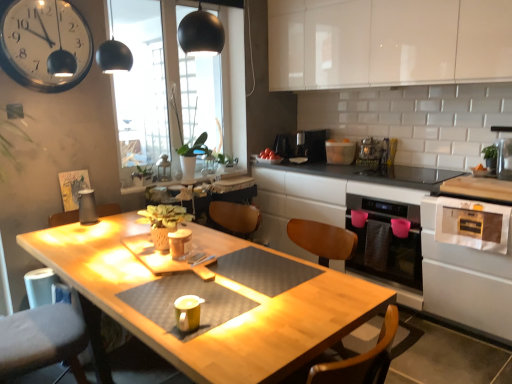
Question: Is white glossy clock at upper left shorter than white glossy toaster at upper center, the sixth appliance viewed from the left?

Choices:
 (A) no
 (B) yes

Answer: (A)

Question: Is white glossy toaster at upper center, positioned as the 3th appliance in right-to-left order, located within white glossy clock at upper left?

Choices:
 (A) no
 (B) yes

Answer: (A)

Question: Is white glossy clock at upper left next to white glossy toaster at upper center, marked as the 3th appliance in a back-to-front arrangement, and touching it?

Choices:
 (A) yes
 (B) no

Answer: (B)

Question: Is white glossy clock at upper left positioned beyond the bounds of white glossy toaster at upper center, the sixth appliance viewed from the left?

Choices:
 (A) no
 (B) yes

Answer: (B)

Question: Could you tell me if white glossy clock at upper left is turned towards white glossy toaster at upper center, the sixth appliance viewed from the left?

Choices:
 (A) yes
 (B) no

Answer: (B)

Question: From a real-world perspective, does white glossy clock at upper left stand above white glossy toaster at upper center, marked as the 3th appliance in a back-to-front arrangement?

Choices:
 (A) no
 (B) yes

Answer: (B)

Question: Is white glossy oven at lower right, placed as the 2th oven when sorted from back to front, outside of matte yellow cup at center, placed as the first appliance when sorted from front to back?

Choices:
 (A) yes
 (B) no

Answer: (A)

Question: Considering the relative positions of white glossy oven at lower right, the 1th oven in the front-to-back sequence, and matte yellow cup at center, placed as the first appliance when sorted from front to back, in the image provided, is white glossy oven at lower right, the 1th oven in the front-to-back sequence, to the left of matte yellow cup at center, placed as the first appliance when sorted from front to back, from the viewer's perspective?

Choices:
 (A) yes
 (B) no

Answer: (B)

Question: Is white glossy oven at lower right, placed as the 2th oven when sorted from back to front, smaller than matte yellow cup at center, placed as the first appliance when sorted from front to back?

Choices:
 (A) no
 (B) yes

Answer: (A)

Question: From a real-world perspective, is white glossy oven at lower right, the 1th oven in the front-to-back sequence, located beneath matte yellow cup at center, the sixth appliance positioned from the right?

Choices:
 (A) yes
 (B) no

Answer: (A)

Question: From the image's perspective, is white glossy oven at lower right, placed as the 2th oven when sorted from back to front, above matte yellow cup at center, the sixth appliance positioned from the right?

Choices:
 (A) no
 (B) yes

Answer: (A)

Question: Is white glossy oven at lower right, the 1th oven in the front-to-back sequence, thinner than matte yellow cup at center, the eighth appliance positioned from the back?

Choices:
 (A) yes
 (B) no

Answer: (B)

Question: Would you consider white glossy oven at lower right, placed as the 2th oven when sorted from back to front, to be distant from green matte plant at center?

Choices:
 (A) yes
 (B) no

Answer: (A)